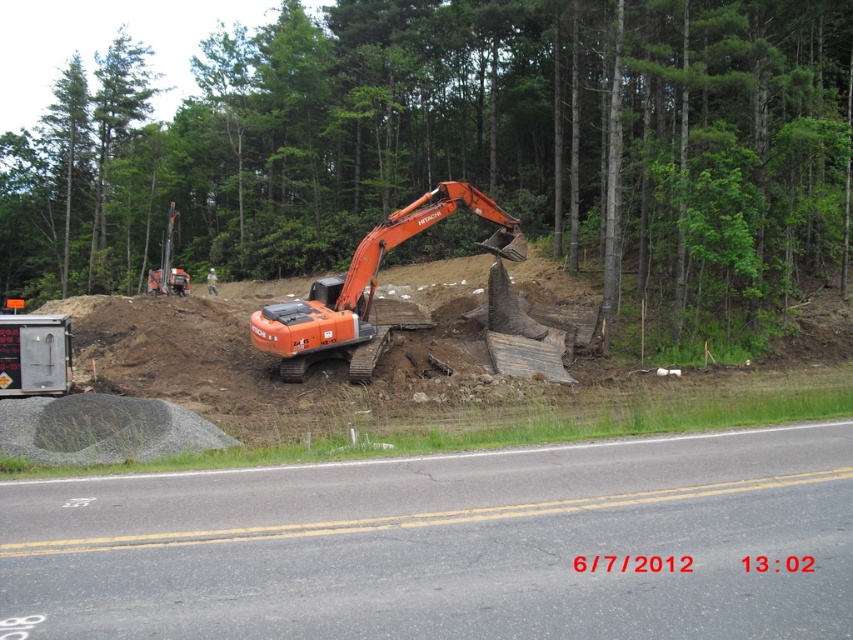
Question: Is brushed metal trailer truck at lower left behind blurred white helmet at center?

Choices:
 (A) yes
 (B) no

Answer: (B)

Question: Is brushed metal trailer truck at lower left closer to the viewer compared to blurred white helmet at center?

Choices:
 (A) yes
 (B) no

Answer: (A)

Question: Which is farther from the black asphalt road at lower center?

Choices:
 (A) orange rubber excavator at center
 (B) brushed metal trailer truck at lower left

Answer: (A)

Question: Based on their relative distances, which object is farther from the brushed metal trailer truck at lower left?

Choices:
 (A) orange rubber excavator at center
 (B) black asphalt road at lower center
 (C) blurred white helmet at center

Answer: (C)

Question: Is brushed metal trailer truck at lower left in front of blurred white helmet at center?

Choices:
 (A) no
 (B) yes

Answer: (B)

Question: Among these objects, which one is nearest to the camera?

Choices:
 (A) black asphalt road at lower center
 (B) brushed metal trailer truck at lower left
 (C) blurred white helmet at center

Answer: (A)